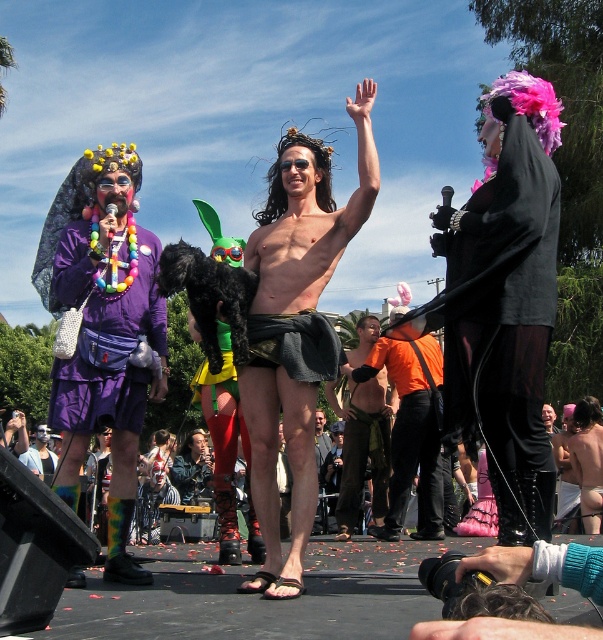
You are a photographer at the festival, and you want to take a photo of the purple fabric purse at left and the natural hair wig at center. Which object will appear closer to the camera in your photo?

The purple fabric purse at left will appear closer to the camera because it is in front of the natural hair wig at center.

In the scene shown: You are a photographer at the festival. You want to take a photo that includes both the matte purple dress at left and the orange fabric shorts at center. The camera you are using has a maximum focus range of 10 meters. Will you be able to capture both subjects in focus?

The matte purple dress at left is 12.42 meters from orange fabric shorts at center. Since the distance between them exceeds the camera maximum focus range of 10 meters, you cannot capture both subjects in focus.